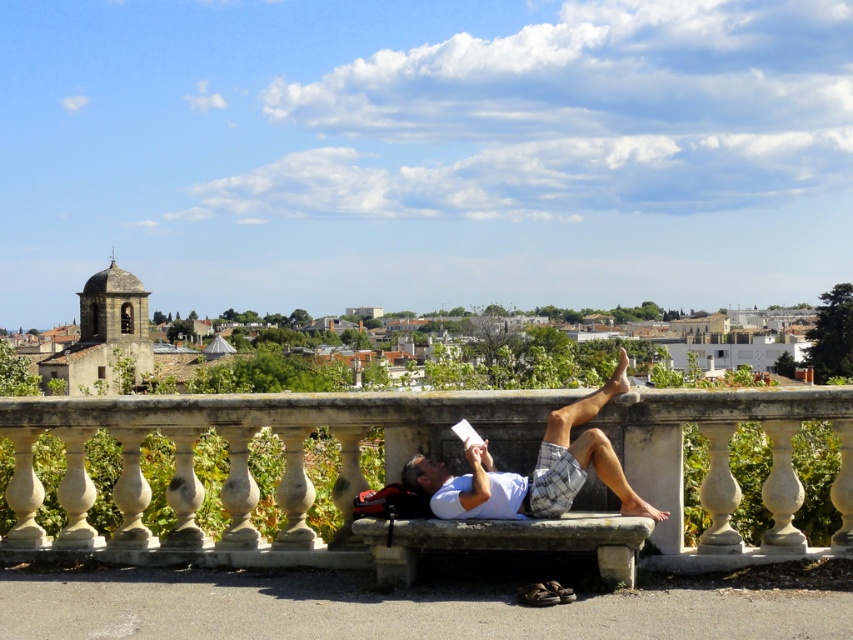
Question: Does white stone bench at center have a greater width compared to white cotton shirt at center?

Choices:
 (A) no
 (B) yes

Answer: (B)

Question: Does white stone bench at center appear on the right side of white cotton shirt at center?

Choices:
 (A) yes
 (B) no

Answer: (B)

Question: In this image, where is white stone bench at center located relative to white cotton shirt at center?

Choices:
 (A) right
 (B) left

Answer: (B)

Question: Among these points, which one is nearest to the camera?

Choices:
 (A) (782, 490)
 (B) (595, 403)

Answer: (B)

Question: Which point is closer to the camera taking this photo?

Choices:
 (A) (579, 401)
 (B) (764, 492)

Answer: (A)